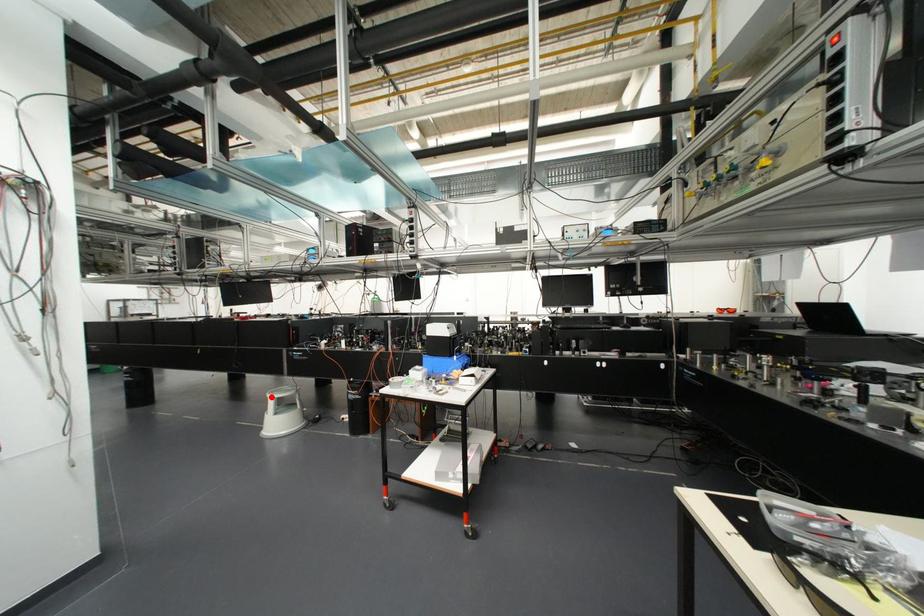
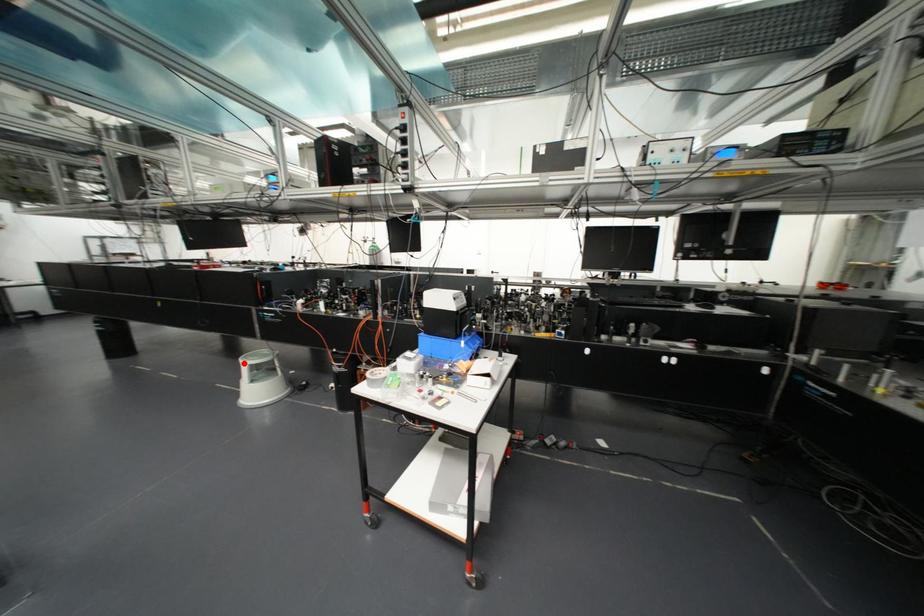
I am providing you with two images of the same scene from different viewpoints. A red point is marked on the first image and another point is marked on the second image. Does the point marked in image1 correspond to the same location as the one in image2?

Yes